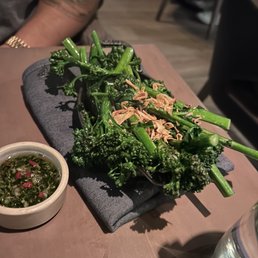
What are the coordinates of `chair leg` in the screenshot? It's located at (211, 31), (161, 15), (200, 96).